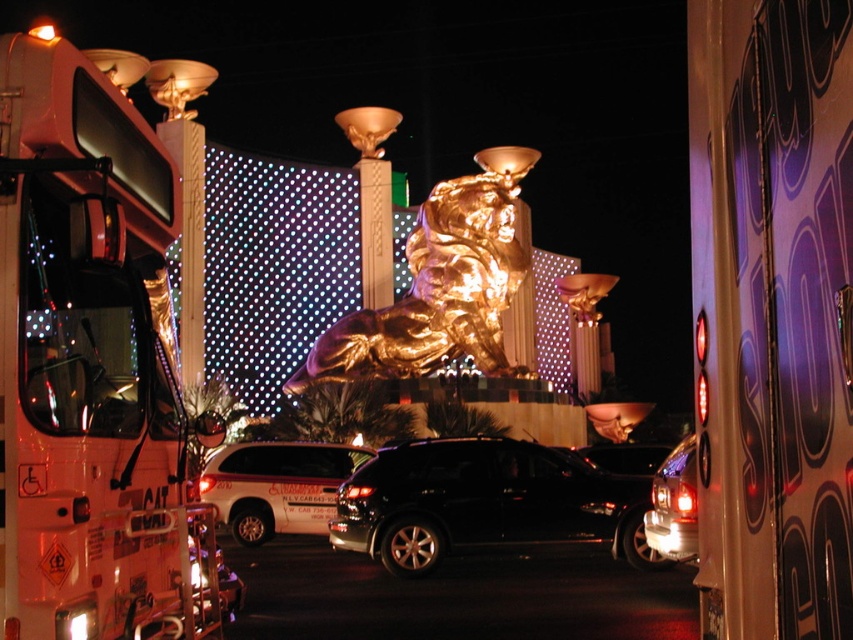
Is point (44, 593) behind point (250, 516)?

No, (44, 593) is in front of (250, 516).

Does point (146, 276) come in front of point (277, 470)?

Yes, it is.

This screenshot has width=853, height=640. Find the location of `white glossy fire truck at left`. white glossy fire truck at left is located at coordinates (93, 369).

Does point (524, 525) come closer to viewer compared to point (230, 483)?

Yes.

Measure the distance between point (531, 481) and camera.

Point (531, 481) is 73.33 meters from camera.

Image resolution: width=853 pixels, height=640 pixels. What do you see at coordinates (485, 502) in the screenshot? I see `black metallic suv at center` at bounding box center [485, 502].

The height and width of the screenshot is (640, 853). Identify the location of black metallic suv at center. (485, 502).

Does white glossy fire truck at left have a lesser width compared to black metallic suv at center?

Yes.

Can you confirm if white glossy fire truck at left is taller than black metallic suv at center?

Indeed, white glossy fire truck at left has a greater height compared to black metallic suv at center.

Between point (1, 376) and point (496, 532), which one is positioned behind?

Positioned behind is point (496, 532).

Identify the location of white glossy fire truck at left. This screenshot has height=640, width=853. (93, 369).